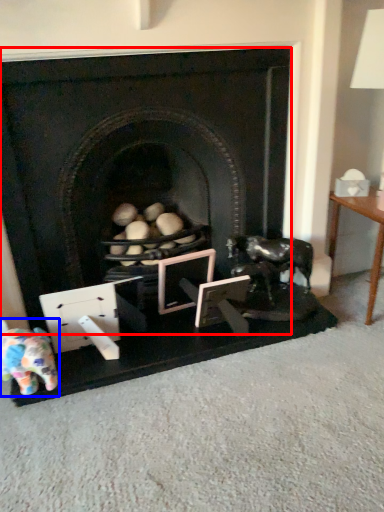
Question: Which object appears farthest to the camera in this image, fireplace (highlighted by a red box) or toy (highlighted by a blue box)?

Choices:
 (A) fireplace
 (B) toy

Answer: (B)